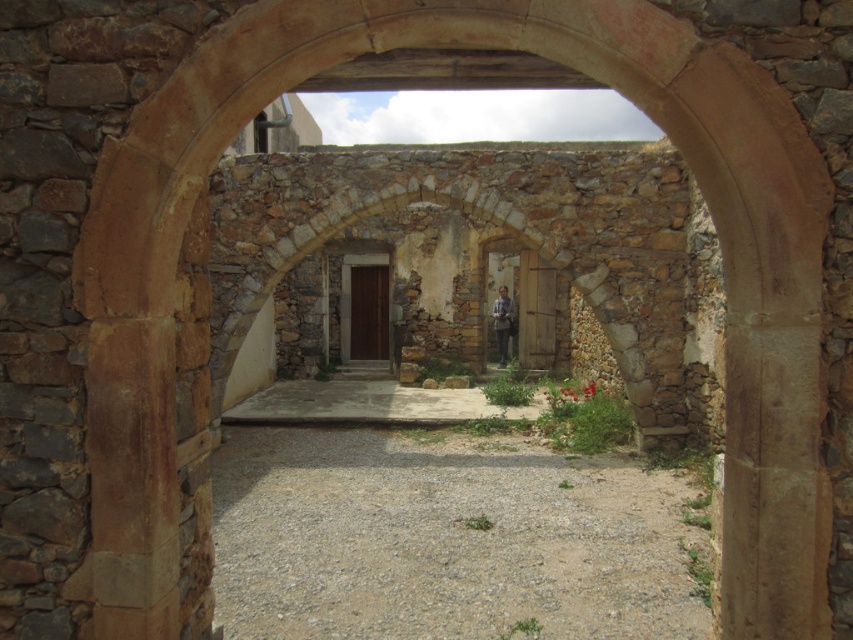
Between point (480, 557) and point (498, 412), which one is positioned behind?

Point (498, 412)

Identify the location of gray gravel at center. (445, 538).